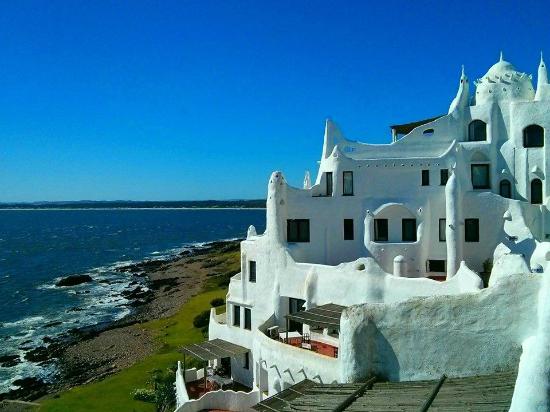
At what (x,y) coordinates should I click in order to perform the action: click on terra cotta flooring. Please return your answer as a coordinate pair (x, y). The image size is (550, 412). Looking at the image, I should click on (321, 348), (195, 385), (219, 407).